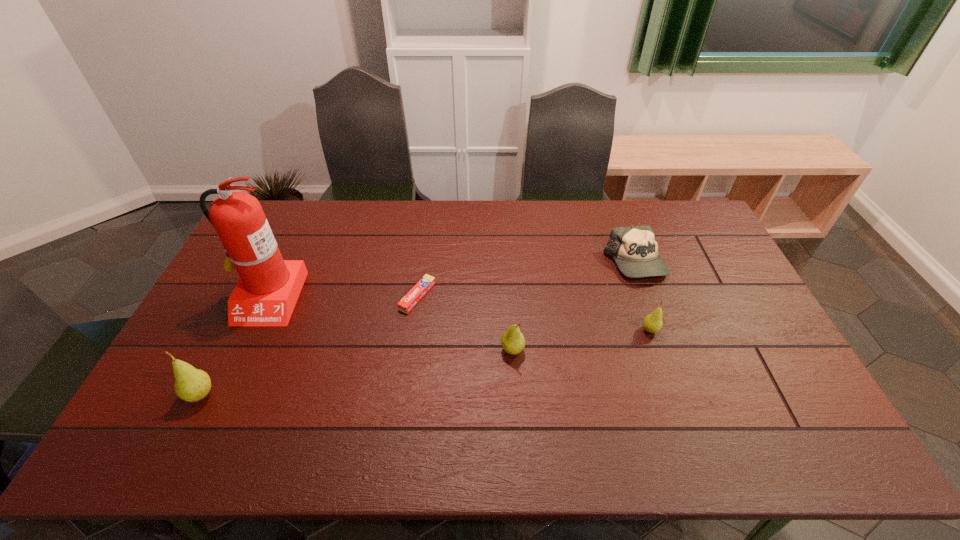
Please mark a free spot for a new pear to balance the arrangement. Please provide its 2D coordinates. Your answer should be formatted as a tuple, i.e. [(x, y)], where the tuple contains the x and y coordinates of a point satisfying the conditions above.

[(363, 372)]